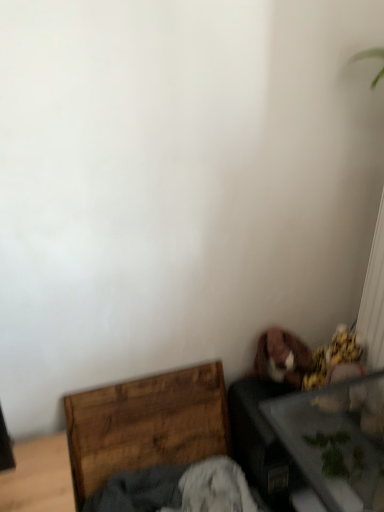
Question: In terms of width, does transparent glass table at lower right look wider or thinner when compared to wooden crate at lower left?

Choices:
 (A) wide
 (B) thin

Answer: (A)

Question: Considering the positions of transparent glass table at lower right and wooden crate at lower left in the image, is transparent glass table at lower right bigger or smaller than wooden crate at lower left?

Choices:
 (A) small
 (B) big

Answer: (B)

Question: Which is correct: transparent glass table at lower right is inside wooden crate at lower left, or outside of it?

Choices:
 (A) inside
 (B) outside

Answer: (B)

Question: Would you say wooden crate at lower left is inside or outside transparent glass table at lower right?

Choices:
 (A) outside
 (B) inside

Answer: (A)

Question: In the image, is wooden crate at lower left positioned in front of or behind transparent glass table at lower right?

Choices:
 (A) front
 (B) behind

Answer: (B)

Question: Considering the relative positions of wooden crate at lower left and transparent glass table at lower right in the image provided, is wooden crate at lower left to the left or to the right of transparent glass table at lower right?

Choices:
 (A) right
 (B) left

Answer: (B)

Question: From a real-world perspective, relative to transparent glass table at lower right, is wooden crate at lower left vertically above or below?

Choices:
 (A) below
 (B) above

Answer: (A)